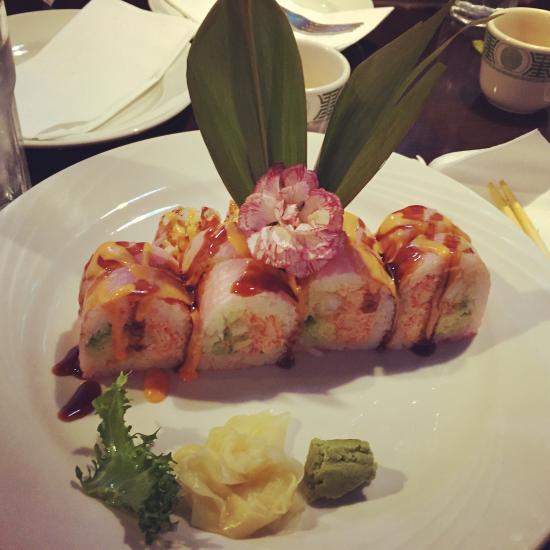
You are a GUI agent. You are given a task and a screenshot of the screen. Output one action in this format:
    pyautogui.click(x=<x>, y=<y>)
    Task: Click on the cup
    This screenshot has width=550, height=550.
    Given the screenshot: What is the action you would take?
    pyautogui.click(x=500, y=78), pyautogui.click(x=317, y=104)